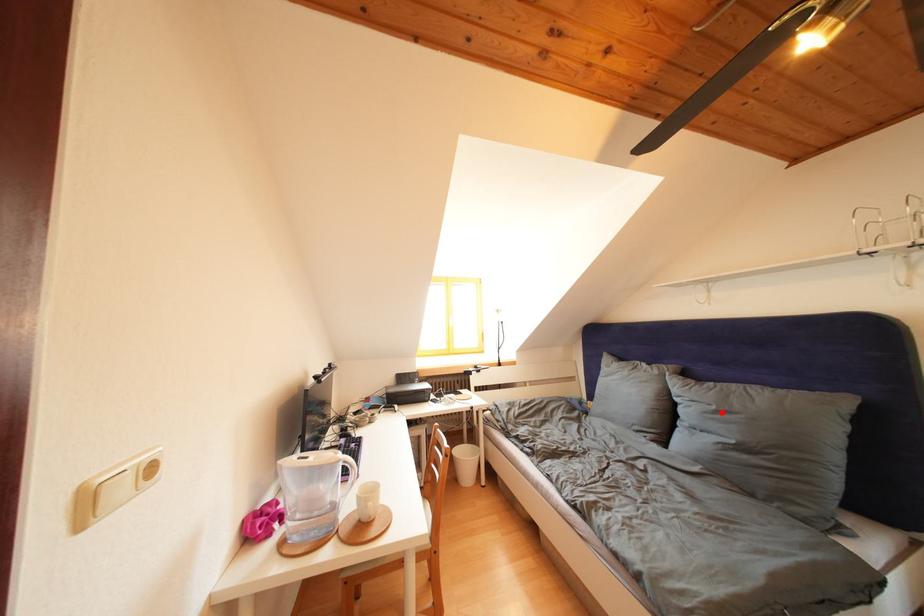
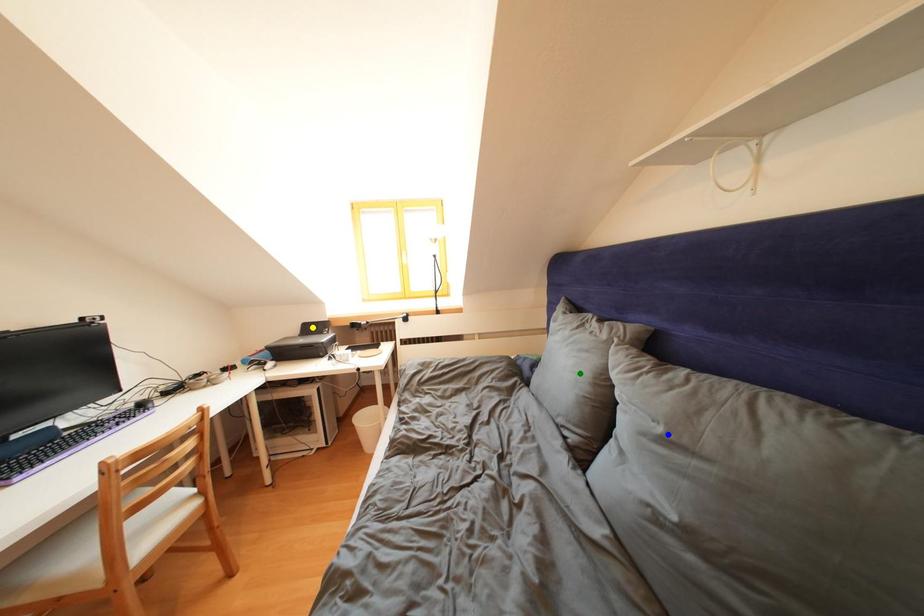
Question: I am providing you with two images of the same scene from different viewpoints. A red point is marked on the first image. You are given multiple points on the second image. Which point in image 2 is actually the same real-world point as the red point in image 1?

Choices:
 (A) green point
 (B) blue point
 (C) yellow point

Answer: (B)